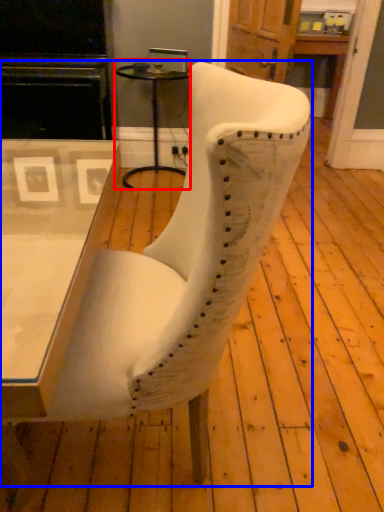
Question: Which of the following is the farthest to the observer, side table (highlighted by a red box) or chair (highlighted by a blue box)?

Choices:
 (A) side table
 (B) chair

Answer: (A)